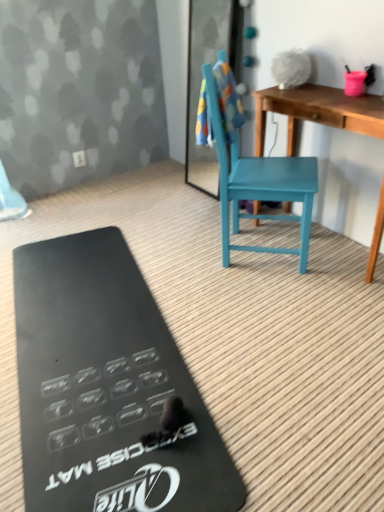
Locate an element on the screen. The width and height of the screenshot is (384, 512). free spot in front of wooden desk at center is located at coordinates (316, 307).